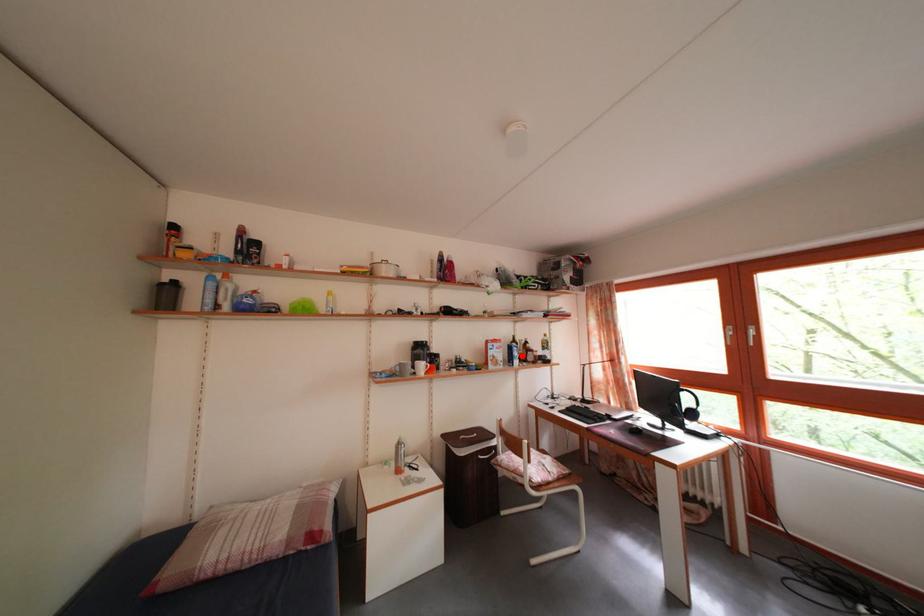
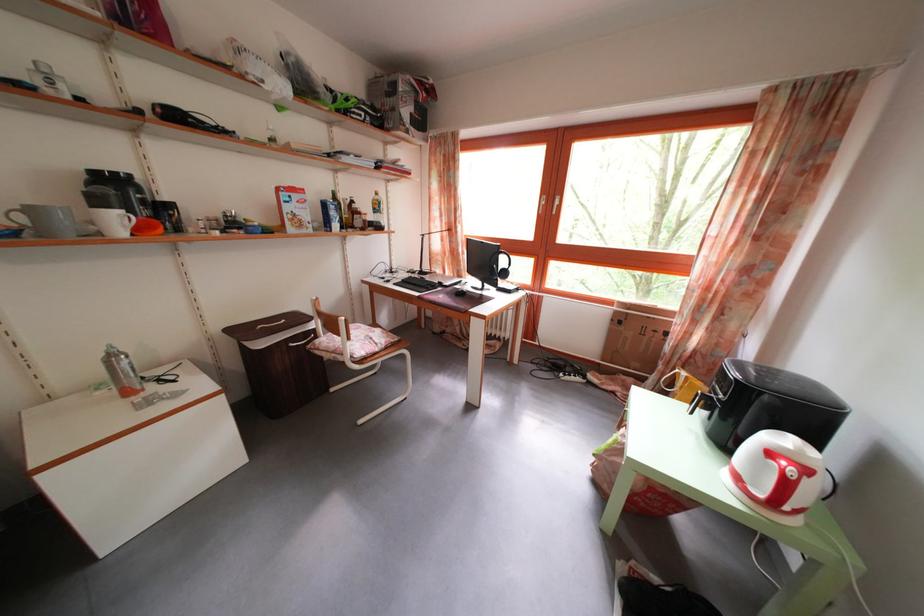
Question: I am providing you with two images of the same scene from different viewpoints. Given a red point in image1, look at the same physical point in image2. Is it:

Choices:
 (A) Closer to the viewpoint
 (B) Farther from the viewpoint

Answer: (A)